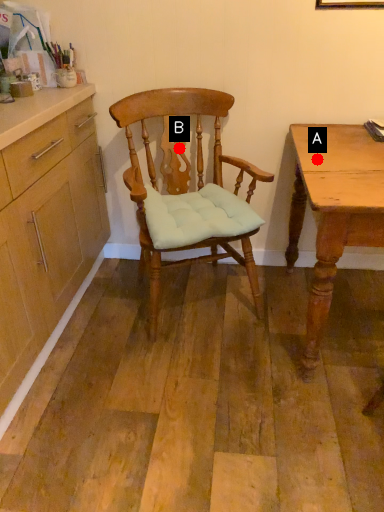
Question: Two points are circled on the image, labeled by A and B beside each circle. Which point is farther from the camera taking this photo?

Choices:
 (A) A is further
 (B) B is further

Answer: (B)